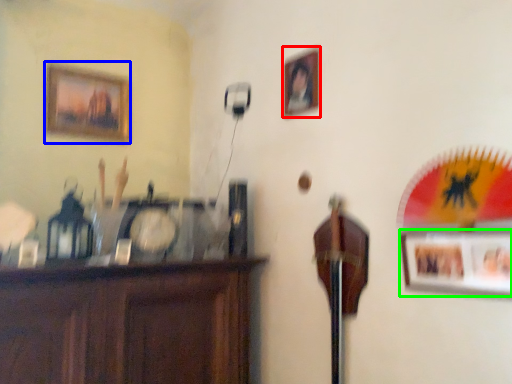
Question: Which object is positioned farthest from picture frame (highlighted by a red box)? Select from picture frame (highlighted by a blue box) and picture frame (highlighted by a green box).

Choices:
 (A) picture frame
 (B) picture frame

Answer: (A)